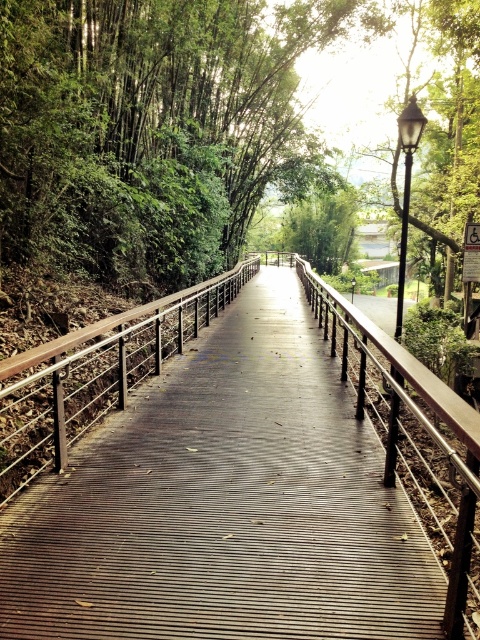
Question: Which object appears farthest from the camera in this image?

Choices:
 (A) wooden walkway at center
 (B) brown wooden balustrade at center

Answer: (B)

Question: Can you confirm if wooden walkway at center is wider than brown wooden balustrade at center?

Choices:
 (A) yes
 (B) no

Answer: (A)

Question: Does wooden walkway at center lie behind brown wooden balustrade at center?

Choices:
 (A) yes
 (B) no

Answer: (B)

Question: Does wooden walkway at center have a greater width compared to brown wooden balustrade at center?

Choices:
 (A) yes
 (B) no

Answer: (A)

Question: Which of the following is the farthest from the observer?

Choices:
 (A) (132, 332)
 (B) (228, 472)

Answer: (A)